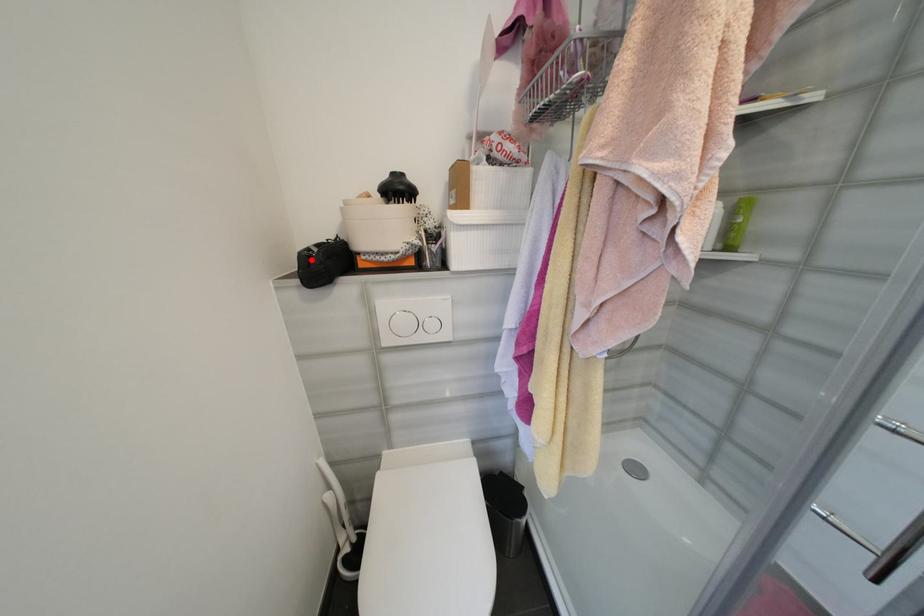
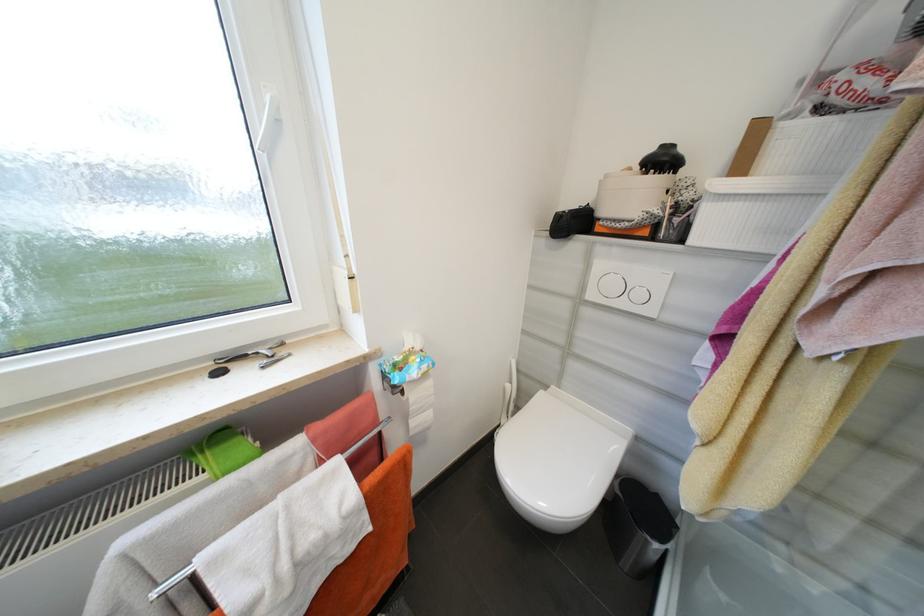
Question: I am providing you with two images of the same scene from different viewpoints. A red point is marked on the first image. Is the red point's position out of view in image 2?

Choices:
 (A) Yes
 (B) No

Answer: (B)